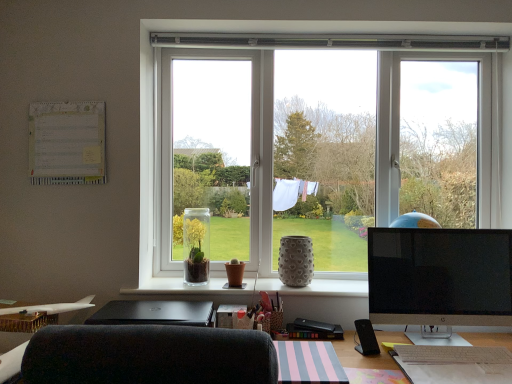
The image size is (512, 384). I want to click on brown matte vase at center, which is counted as the second vase, starting from the left, so click(x=234, y=273).

The height and width of the screenshot is (384, 512). What do you see at coordinates (67, 143) in the screenshot?
I see `white paperboard at upper left` at bounding box center [67, 143].

The height and width of the screenshot is (384, 512). What are the coordinates of `white textured vase at center` in the screenshot? It's located at (252, 288).

The height and width of the screenshot is (384, 512). I want to click on white plastic keyboard at lower right, so click(454, 364).

Describe the element at coordinates (50, 308) in the screenshot. I see `white matte airplane at lower left` at that location.

This screenshot has width=512, height=384. What do you see at coordinates (313, 330) in the screenshot? I see `matte black stapler at lower center` at bounding box center [313, 330].

Where is `brown matte vase at center, the second vase positioned from the right`? brown matte vase at center, the second vase positioned from the right is located at coordinates (234, 273).

Which object is further away from the camera, gray textured vase at center, which is the 1th vase from right to left, or pink striped notepad at lower center?

gray textured vase at center, which is the 1th vase from right to left.

Measure the distance from gray textured vase at center, which is the 1th vase from right to left, to pink striped notepad at lower center.

gray textured vase at center, which is the 1th vase from right to left, is 60.28 centimeters away from pink striped notepad at lower center.

Is gray textured vase at center, which is the 1th vase from right to left, with pink striped notepad at lower center?

No, gray textured vase at center, which is the 1th vase from right to left, is not with pink striped notepad at lower center.

Can you confirm if gray textured vase at center, which is the 1th vase from right to left, is positioned to the right of pink striped notepad at lower center?

Yes, gray textured vase at center, which is the 1th vase from right to left, is to the right of pink striped notepad at lower center.

Is pink striped notepad at lower center turned away from white plastic keyboard at lower right?

No, pink striped notepad at lower center is not facing the opposite direction of white plastic keyboard at lower right.

How many degrees apart are the facing directions of pink striped notepad at lower center and white plastic keyboard at lower right?

1.78 degrees.

Consider the image. Is pink striped notepad at lower center shorter than white plastic keyboard at lower right?

In fact, pink striped notepad at lower center may be taller than white plastic keyboard at lower right.

From a real-world perspective, which is physically below, pink striped notepad at lower center or white plastic keyboard at lower right?

In real-world perspective, white plastic keyboard at lower right is lower.

I want to click on the 1st vase to the left of the black glossy monitor at right, starting your count from the anchor, so click(x=296, y=261).

Considering their positions, is gray textured vase at center, which is the third vase in left-to-right order, located in front of or behind black glossy monitor at right?

In the image, gray textured vase at center, which is the third vase in left-to-right order, appears behind black glossy monitor at right.

Considering the sizes of objects gray textured vase at center, which is the third vase in left-to-right order, and black glossy monitor at right in the image provided, who is taller, gray textured vase at center, which is the third vase in left-to-right order, or black glossy monitor at right?

Standing taller between the two is black glossy monitor at right.

Is gray textured vase at center, which is the third vase in left-to-right order, bigger than black glossy monitor at right?

Incorrect, gray textured vase at center, which is the third vase in left-to-right order, is not larger than black glossy monitor at right.

Measure the distance from matte black stapler at lower center to white paperboard at upper left.

matte black stapler at lower center and white paperboard at upper left are 4.02 feet apart.

Considering the points (328, 335) and (34, 137), which point is in front, point (328, 335) or point (34, 137)?

Point (328, 335)

Is matte black stapler at lower center aimed at white paperboard at upper left?

No, matte black stapler at lower center does not turn towards white paperboard at upper left.

From the picture: Considering the relative positions of black plastic speaker at lower right and clear glass vase at center, the 3th vase positioned from the right, in the image provided, is black plastic speaker at lower right to the left of clear glass vase at center, the 3th vase positioned from the right, from the viewer's perspective?

No.

Based on the photo, from the image's perspective, is black plastic speaker at lower right on top of clear glass vase at center, which appears as the first vase when viewed from the left?

Incorrect, from the image's perspective, black plastic speaker at lower right is lower than clear glass vase at center, which appears as the first vase when viewed from the left.

Does point (358, 330) come in front of point (184, 243)?

Yes, it is.

Measure the distance between black plastic speaker at lower right and clear glass vase at center, the 3th vase positioned from the right.

A distance of 30.93 inches exists between black plastic speaker at lower right and clear glass vase at center, the 3th vase positioned from the right.

Is white matte airplane at lower left to the left or to the right of white paperboard at upper left in the image?

Clearly, white matte airplane at lower left is on the right of white paperboard at upper left in the image.

In terms of size, does white matte airplane at lower left appear bigger or smaller than white paperboard at upper left?

In the image, white matte airplane at lower left appears to be larger than white paperboard at upper left.

Does white matte airplane at lower left touch white paperboard at upper left?

No, white matte airplane at lower left is not with white paperboard at upper left.

From a real-world perspective, is white paperboard at upper left positioned above or below brown matte vase at center, which is counted as the second vase, starting from the left?

white paperboard at upper left is situated higher than brown matte vase at center, which is counted as the second vase, starting from the left, in the real world.

Based on the photo, considering the sizes of objects white paperboard at upper left and brown matte vase at center, which is counted as the second vase, starting from the left, in the image provided, who is thinner, white paperboard at upper left or brown matte vase at center, which is counted as the second vase, starting from the left,?

With smaller width is white paperboard at upper left.

Find the location of a particular element. The width and height of the screenshot is (512, 384). the 2nd vase counting from the right of the white paperboard at upper left is located at coordinates (234, 273).

Is white paperboard at upper left outside of brown matte vase at center, the second vase positioned from the right?

Absolutely, white paperboard at upper left is external to brown matte vase at center, the second vase positioned from the right.

Identify the location of the 1st vase behind the pink striped notepad at lower center, counting from the anchor's position. The width and height of the screenshot is (512, 384). (296, 261).

At what (x,y) coordinates should I click in order to perform the action: click on notepad on the left of white plastic keyboard at lower right. Please return your answer as a coordinate pair (x, y). Looking at the image, I should click on (309, 363).

Looking at the image, which one is located further to matte black stapler at lower center, white matte airplane at lower left or black plastic speaker at lower right?

white matte airplane at lower left is further to matte black stapler at lower center.

Looking at the image, which one is located closer to brown matte vase at center, which is counted as the second vase, starting from the left, gray textured vase at center, which is the third vase in left-to-right order, or black glossy monitor at right?

gray textured vase at center, which is the third vase in left-to-right order.

When comparing their distances from pink striped notepad at lower center, does matte black stapler at lower center or clear glass vase at center, which appears as the first vase when viewed from the left, seem closer?

matte black stapler at lower center lies closer to pink striped notepad at lower center than the other object.

Considering their positions, is white paperboard at upper left positioned closer to clear glass vase at center, which appears as the first vase when viewed from the left, than brown matte vase at center, the second vase positioned from the right?

brown matte vase at center, the second vase positioned from the right.

When comparing their distances from white plastic keyboard at lower right, does white matte airplane at lower left or brown matte vase at center, which is counted as the second vase, starting from the left, seem closer?

brown matte vase at center, which is counted as the second vase, starting from the left, is closer to white plastic keyboard at lower right.

In the scene shown: Considering their positions, is white textured vase at center positioned further to pink striped notepad at lower center than black glossy monitor at right?

The object further to pink striped notepad at lower center is white textured vase at center.

Based on their spatial positions, is black plastic speaker at lower right or clear glass vase at center, which appears as the first vase when viewed from the left, further from black glossy monitor at right?

The object further to black glossy monitor at right is clear glass vase at center, which appears as the first vase when viewed from the left.

From the image, which object appears to be nearer to white textured vase at center, matte black stapler at lower center or clear glass vase at center, the 3th vase positioned from the right?

clear glass vase at center, the 3th vase positioned from the right.

The height and width of the screenshot is (384, 512). What are the coordinates of `airplane between white paperboard at upper left and brown matte vase at center, the second vase positioned from the right` in the screenshot? It's located at (50, 308).

In order to click on stationery located between clear glass vase at center, the 3th vase positioned from the right, and black plastic speaker at lower right in the left-right direction in this screenshot , I will do `click(313, 330)`.

Locate an element on the screen. This screenshot has width=512, height=384. window sill situated between white paperboard at upper left and matte black stapler at lower center from left to right is located at coordinates (252, 288).

Identify the location of notepad between clear glass vase at center, which appears as the first vase when viewed from the left, and black glossy monitor at right. click(309, 363).